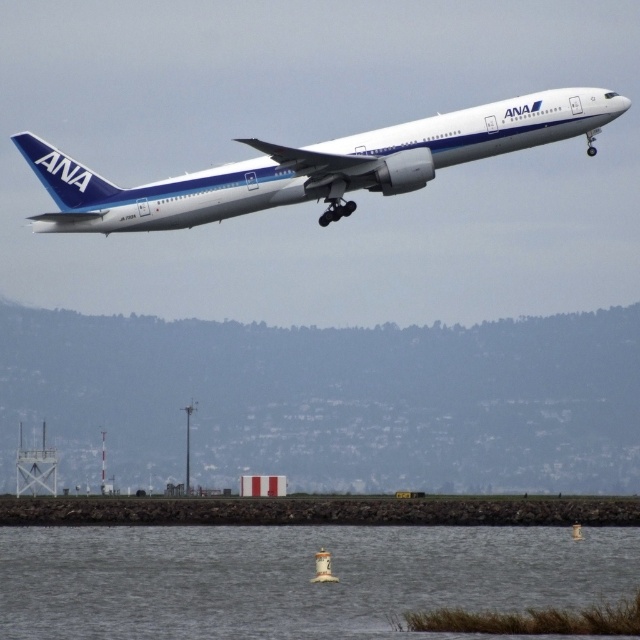
Question: Which of the following is the closest to the observer?

Choices:
 (A) (452, 541)
 (B) (390, 131)

Answer: (B)

Question: Which point appears closest to the camera in this image?

Choices:
 (A) pos(426,568)
 (B) pos(394,189)

Answer: (B)

Question: Which object is closer to the camera taking this photo?

Choices:
 (A) white metallic airplane at center
 (B) gray water at lower center

Answer: (B)

Question: Does gray water at lower center lie in front of white metallic airplane at center?

Choices:
 (A) yes
 (B) no

Answer: (A)

Question: Considering the relative positions of gray water at lower center and white metallic airplane at center in the image provided, where is gray water at lower center located with respect to white metallic airplane at center?

Choices:
 (A) above
 (B) below

Answer: (B)

Question: Is gray water at lower center behind white metallic airplane at center?

Choices:
 (A) yes
 (B) no

Answer: (B)